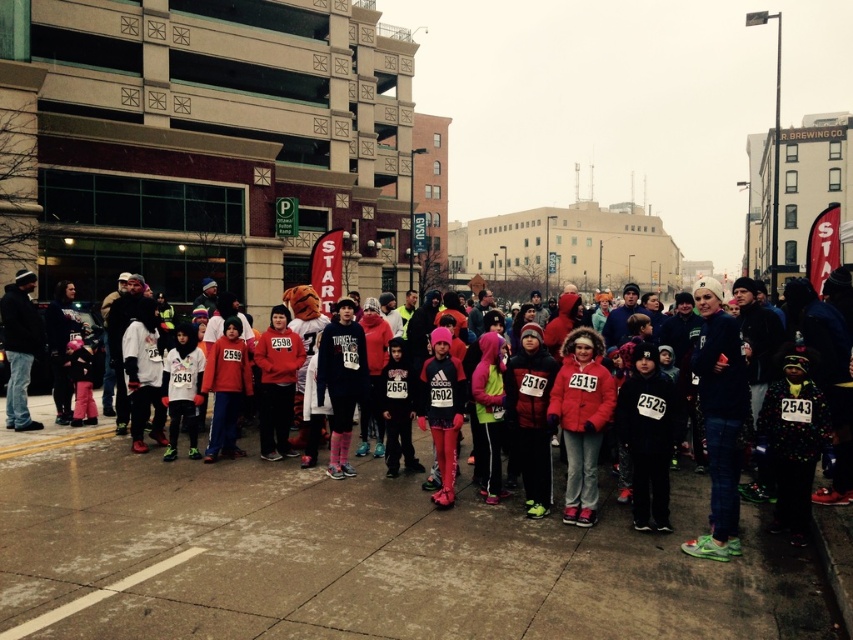
Question: Which point is closer to the camera?

Choices:
 (A) matte black hoodie at center
 (B) matte red coat at center

Answer: (B)

Question: Considering the relative positions of matte red coat at center and matte black hoodie at center in the image provided, where is matte red coat at center located with respect to matte black hoodie at center?

Choices:
 (A) below
 (B) above

Answer: (A)

Question: Which object is positioned closest to the matte black hoodie at center?

Choices:
 (A) matte red coat at center
 (B) pink matte leggings at center

Answer: (B)

Question: Which object is closer to the camera taking this photo?

Choices:
 (A) matte red jacket at center
 (B) matte red coat at center
 (C) pink matte leggings at center
 (D) matte black hoodie at center

Answer: (B)

Question: Does matte red jacket at center have a larger size compared to matte red coat at center?

Choices:
 (A) no
 (B) yes

Answer: (A)

Question: Can you confirm if matte red jacket at center is positioned to the left of matte red coat at center?

Choices:
 (A) yes
 (B) no

Answer: (B)